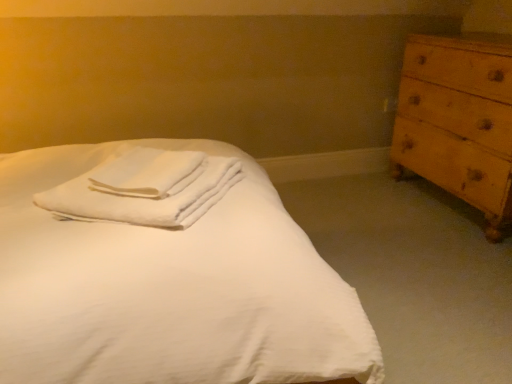
Image resolution: width=512 pixels, height=384 pixels. What are the coordinates of `space that is in front of white soft towel at center` in the screenshot? It's located at (136, 210).